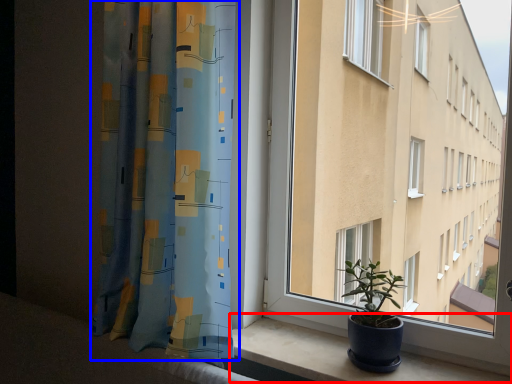
Question: Which object is closer to the camera taking this photo, window sill (highlighted by a red box) or curtain (highlighted by a blue box)?

Choices:
 (A) window sill
 (B) curtain

Answer: (A)